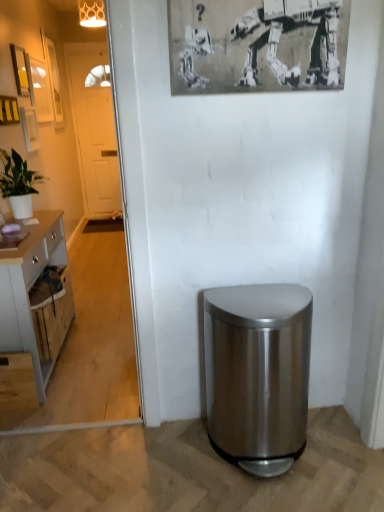
Question: Does point (49, 87) appear closer or farther from the camera than point (261, 367)?

Choices:
 (A) closer
 (B) farther

Answer: (B)

Question: Which is correct: wooden picture frame at upper left, which is the 6th picture frame from front to back, is inside stainless steel trash can at lower right, or outside of it?

Choices:
 (A) outside
 (B) inside

Answer: (A)

Question: Estimate the real-world distances between objects in this image. Which object is closer to the black and white paper at upper center, the first picture frame in the front-to-back sequence?

Choices:
 (A) matte black picture frame at upper left, placed as the fourth picture frame when sorted from back to front
 (B) wooden picture frame at upper left, the second picture frame when ordered from front to back
 (C) wooden picture frame at upper left, acting as the 1th picture frame starting from the back
 (D) white wooden door at left
 (E) stainless steel trash can at lower right

Answer: (E)

Question: Based on their relative distances, which object is farther from the matte black picture frame at upper left, acting as the 3th picture frame starting from the left?

Choices:
 (A) green matte plant at left
 (B) metallic glass lampshade at upper center
 (C) light gray wood cabinet at left
 (D) wooden picture frame at upper left, the second picture frame from the right
 (E) matte white picture frame at upper left, the 2th picture frame when ordered from back to front

Answer: (B)